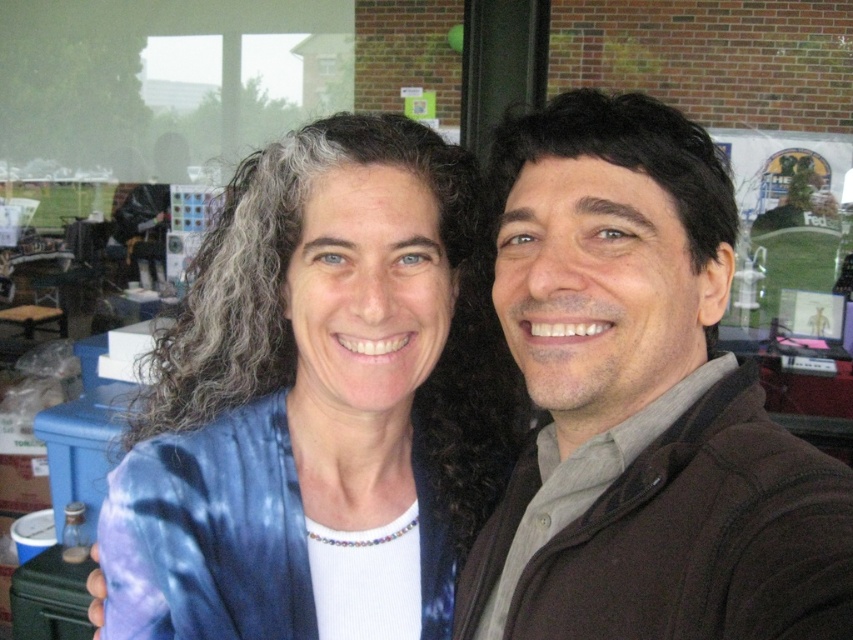
Is brown fuzzy jacket at right below tie-dye fabric at center?

No.

In the scene shown: Is brown fuzzy jacket at right bigger than tie-dye fabric at center?

No.

Describe the element at coordinates (641, 404) in the screenshot. The image size is (853, 640). I see `brown fuzzy jacket at right` at that location.

Locate an element on the screen. Image resolution: width=853 pixels, height=640 pixels. brown fuzzy jacket at right is located at coordinates (641, 404).